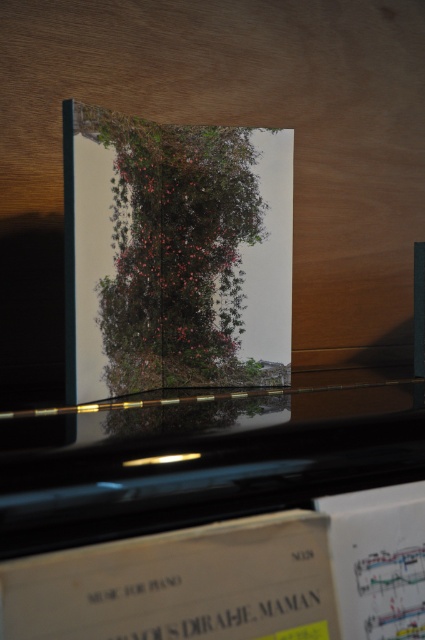
You are standing in front of the piano keyboard and want to place a small ornament between the two points labeled point [252,513] and point [153,216]. Which point should you place it closer to so that it appears closer to you?

You should place the ornament closer to point [252,513] because it is in front of point [153,216], making it closer to your position.

You are standing in front of a piano with a sheet music book. There is a point labeled at coordinates (x=414, y=608) on the piano keyboard. If you want to place a small sticker exactly at that point, how far in inches should you place it from your current position?

The point labeled at coordinates (x=414, y=608) is 16.57 inches away from the viewer. Therefore, you should place the sticker 16.57 inches away from your current position.

You are a photographer standing 12 inches away from a piano keyboard. You want to take a close up photo of the white paper music at lower center. Can you reach it without moving your position?

The white paper music at lower center is 11.88 inches away from camera, so yes, you can reach it without moving since you are 12 inches away from the piano keyboard.